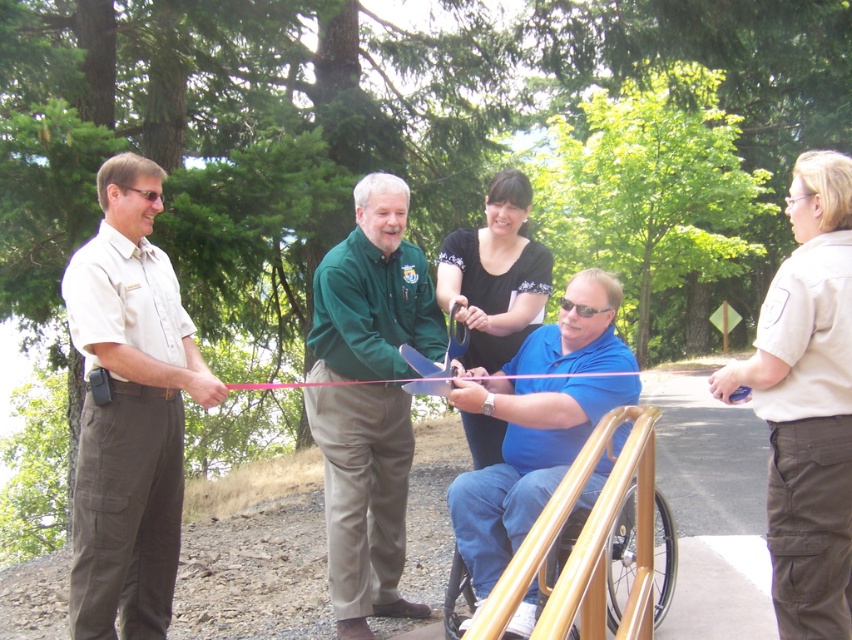
Question: Is green matte shirt at center to the right of black matte shirt at center from the viewer's perspective?

Choices:
 (A) no
 (B) yes

Answer: (A)

Question: Which point is farther to the camera?

Choices:
 (A) tan uniform at right
 (B) green matte shirt at center
 (C) khaki uniform pants at left
 (D) wooden textured wheelchair at lower center

Answer: (B)

Question: Which point appears closest to the camera in this image?

Choices:
 (A) (504, 205)
 (B) (344, 419)
 (C) (501, 627)
 (D) (824, 611)

Answer: (C)

Question: Is wooden textured wheelchair at lower center bigger than black matte shirt at center?

Choices:
 (A) no
 (B) yes

Answer: (B)

Question: Does green matte shirt at center have a lesser width compared to black matte shirt at center?

Choices:
 (A) no
 (B) yes

Answer: (A)

Question: Which of the following is the closest to the observer?

Choices:
 (A) (373, 276)
 (B) (446, 241)

Answer: (A)